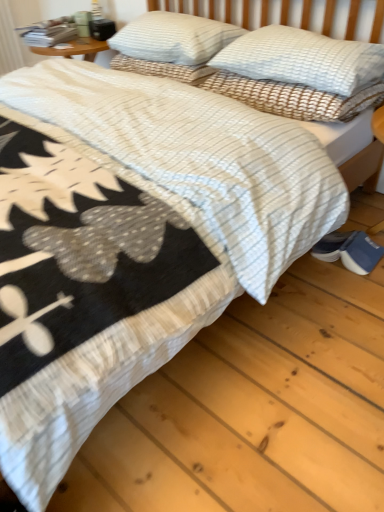
Question: From the image's perspective, is blue suede shoes at lower right below white textured pillow at upper right, the second pillow positioned from the left?

Choices:
 (A) no
 (B) yes

Answer: (B)

Question: Does blue suede shoes at lower right appear on the left side of white textured pillow at upper right, the second pillow positioned from the left?

Choices:
 (A) no
 (B) yes

Answer: (A)

Question: Considering the relative sizes of blue suede shoes at lower right and white textured pillow at upper right, placed as the second pillow when sorted from right to left, in the image provided, is blue suede shoes at lower right thinner than white textured pillow at upper right, placed as the second pillow when sorted from right to left,?

Choices:
 (A) no
 (B) yes

Answer: (B)

Question: Does blue suede shoes at lower right touch white textured pillow at upper right, the second pillow positioned from the left?

Choices:
 (A) no
 (B) yes

Answer: (A)

Question: Can you confirm if blue suede shoes at lower right is smaller than white textured pillow at upper right, placed as the second pillow when sorted from right to left?

Choices:
 (A) no
 (B) yes

Answer: (B)

Question: Considering the relative sizes of blue suede shoes at lower right and white textured pillow at upper right, the second pillow positioned from the left, in the image provided, is blue suede shoes at lower right bigger than white textured pillow at upper right, the second pillow positioned from the left,?

Choices:
 (A) no
 (B) yes

Answer: (A)

Question: Is white textured pillow at upper center, the first pillow from the right, facing away from blue suede shoes at lower right?

Choices:
 (A) no
 (B) yes

Answer: (A)

Question: Is white textured pillow at upper center, placed as the 3th pillow when sorted from left to right, outside blue suede shoes at lower right?

Choices:
 (A) yes
 (B) no

Answer: (A)

Question: Could you tell me if white textured pillow at upper center, placed as the 3th pillow when sorted from left to right, is facing blue suede shoes at lower right?

Choices:
 (A) no
 (B) yes

Answer: (A)

Question: Is blue suede shoes at lower right surrounded by white textured pillow at upper center, the first pillow from the right?

Choices:
 (A) yes
 (B) no

Answer: (B)

Question: Is white textured pillow at upper center, placed as the 3th pillow when sorted from left to right, positioned before blue suede shoes at lower right?

Choices:
 (A) yes
 (B) no

Answer: (A)

Question: From the image's perspective, is white textured pillow at upper center, the first pillow from the right, located beneath blue suede shoes at lower right?

Choices:
 (A) yes
 (B) no

Answer: (B)

Question: Can you confirm if white textured pillow at upper right, the second pillow positioned from the left, is wider than white textured pillow at upper center, the first pillow from the right?

Choices:
 (A) no
 (B) yes

Answer: (A)